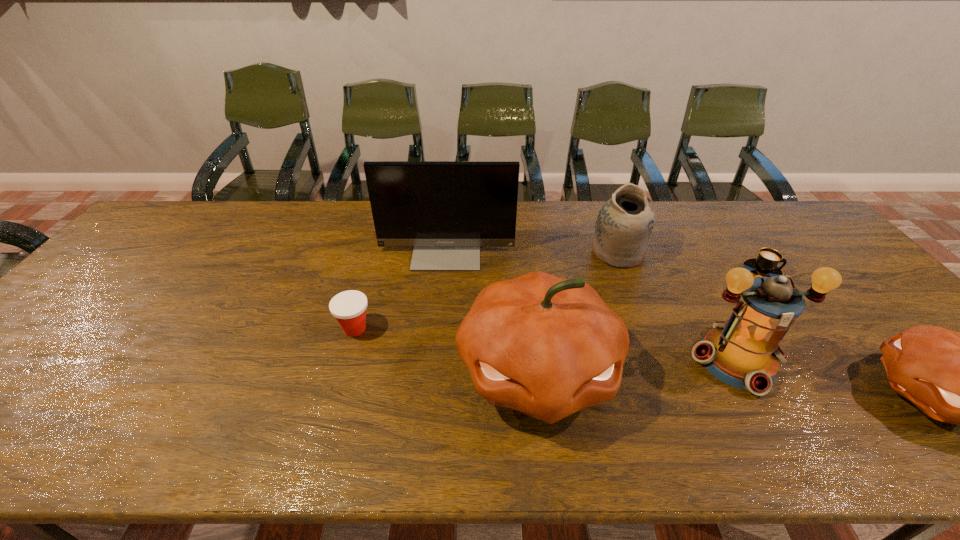
Locate an element on the screen. free space between the shortest object and the taller pumpkin is located at coordinates (650, 321).

The height and width of the screenshot is (540, 960). I want to click on free spot between the taller pumpkin and the second shortest object, so click(x=446, y=350).

At what (x,y) coordinates should I click in order to perform the action: click on object that is the closest one to the shortest object. Please return your answer as a coordinate pair (x, y). Looking at the image, I should click on (743, 352).

Locate an element on the screen. The image size is (960, 540). object identified as the closest to the lantern is located at coordinates (956, 377).